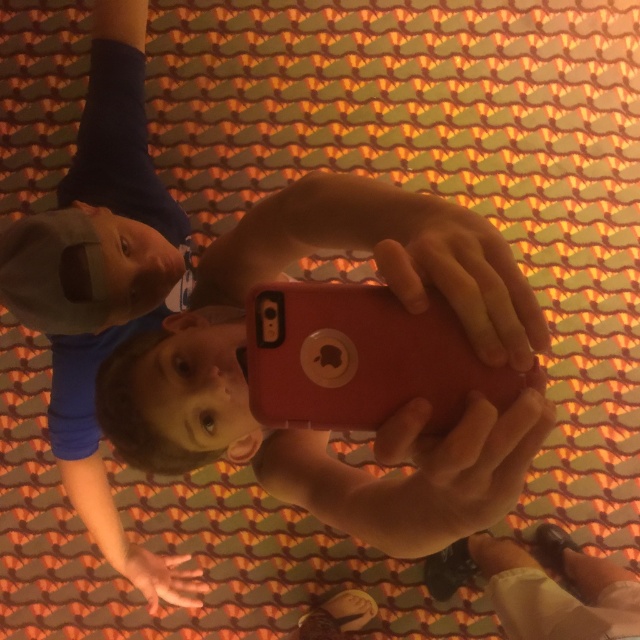
You are trying to locate the matte red phone at center in a room with a patterned carpet. Based on its coordinates, where would you find it?

The matte red phone at center is located at coordinates point (324,432), which places it in the lower central area of the room.

You are holding a smartphone with a red case and want to take a selfie. The camera is at point (408, 209). If you need to position the camera exactly 24 inches away from the point to get a perfect shot, should you move closer or farther away?

The current distance between the camera and point (408, 209) is 22.29 inches. Since 22.29 is less than 24, you should move farther away to reach the desired distance.